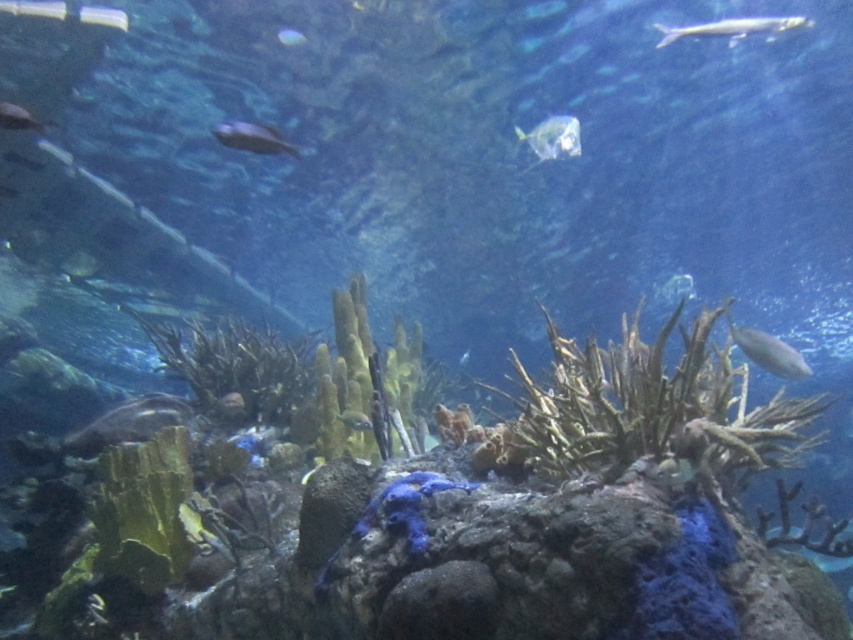
Is point (705, 26) positioned behind point (756, 349)?

No.

Can you confirm if translucent silver fish at upper right is taller than shiny silver fish at right?

Correct, translucent silver fish at upper right is much taller as shiny silver fish at right.

The width and height of the screenshot is (853, 640). What do you see at coordinates (733, 28) in the screenshot? I see `translucent silver fish at upper right` at bounding box center [733, 28].

Find the location of a particular element. The width and height of the screenshot is (853, 640). translucent silver fish at upper right is located at coordinates (733, 28).

Does translucent glass fish at upper center have a lesser height compared to translucent glass fish at center?

Incorrect, translucent glass fish at upper center's height does not fall short of translucent glass fish at center's.

Is translucent glass fish at upper center closer to camera compared to translucent glass fish at center?

Yes, translucent glass fish at upper center is in front of translucent glass fish at center.

Is point (534, 145) farther from viewer compared to point (688, 276)?

No, it is in front of (688, 276).

The height and width of the screenshot is (640, 853). In order to click on translucent glass fish at upper center in this screenshot , I will do `click(552, 138)`.

Is point (33, 129) farther from viewer compared to point (354, 419)?

Yes, point (33, 129) is farther from viewer.

Locate an element on the screen. The image size is (853, 640). shiny silver fish at upper left is located at coordinates coord(19,118).